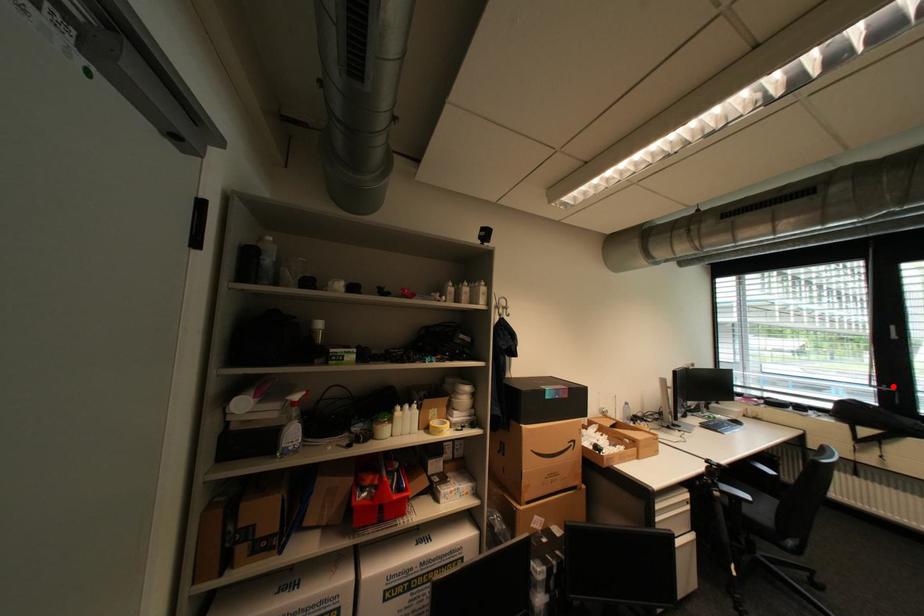
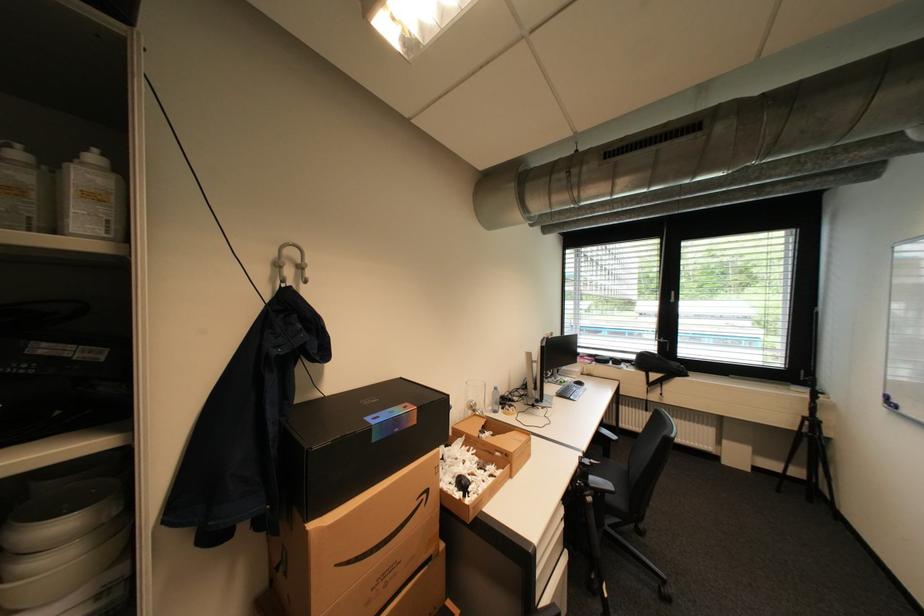
Where in the second image is the point corresponding to the highlighted location from the first image?

(670, 339)